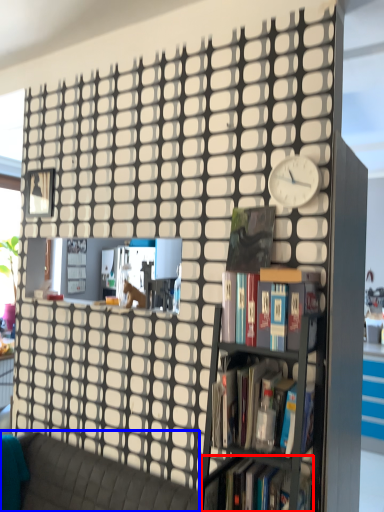
Question: Among these objects, which one is nearest to the camera, book (highlighted by a red box) or studio couch (highlighted by a blue box)?

Choices:
 (A) book
 (B) studio couch

Answer: (B)